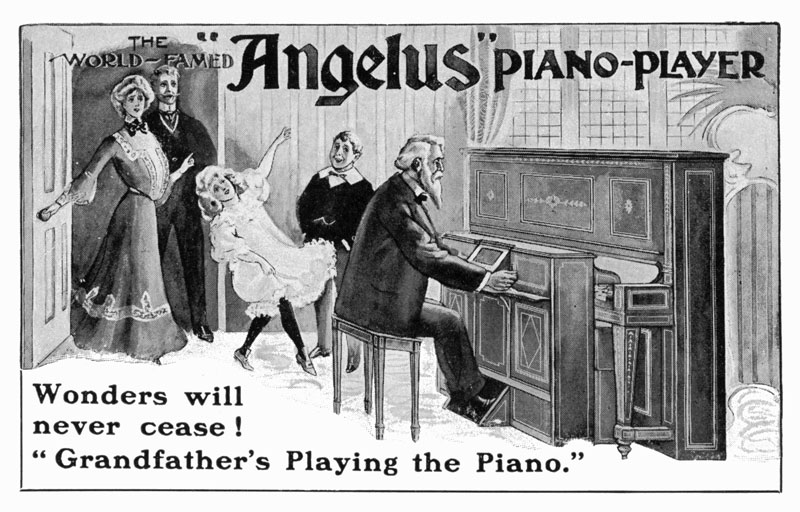
I want to click on wall, so click(424, 103).